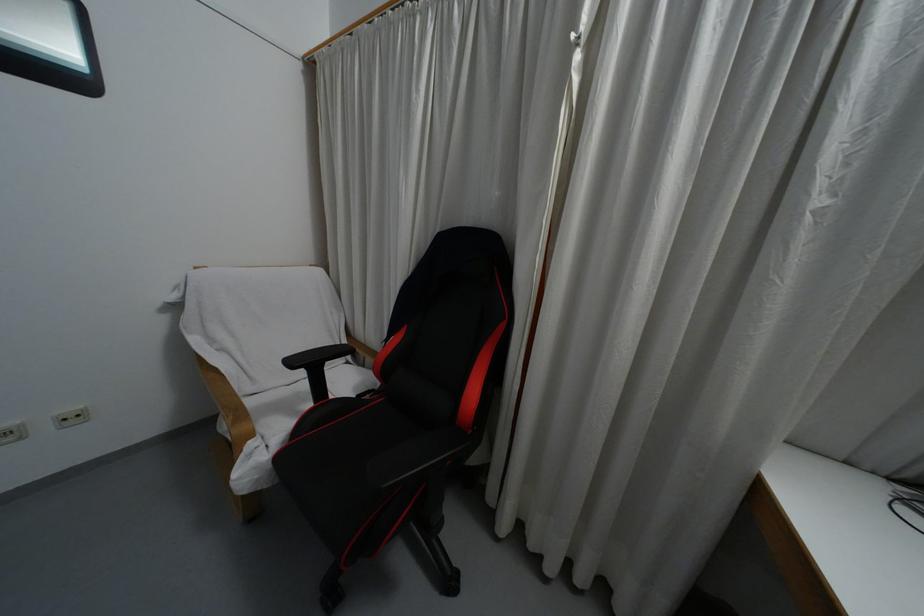
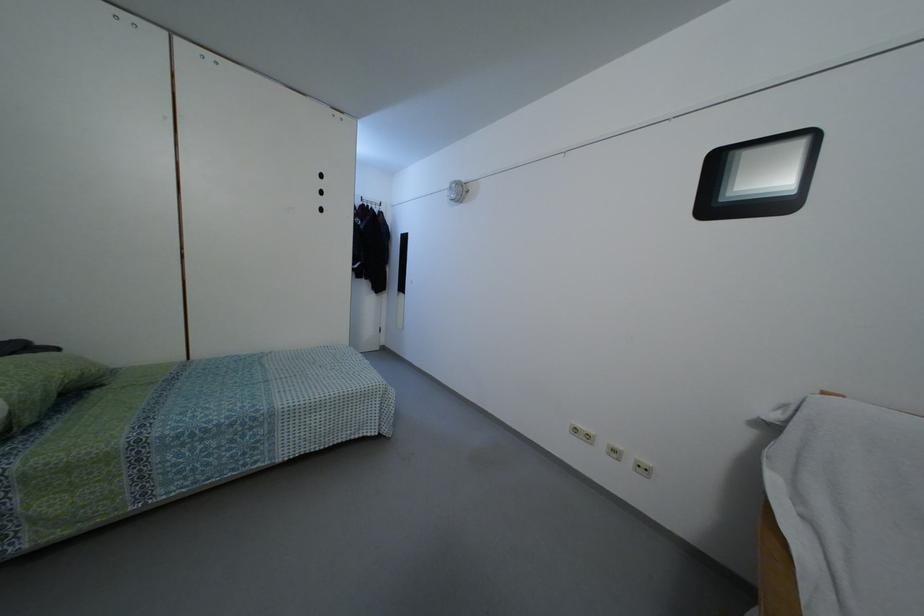
Question: The camera is either moving clockwise (left) or counter-clockwise (right) around the object. The first image is from the beginning of the video and the second image is from the end. Is the camera moving left or right when shooting the video?

Choices:
 (A) Left
 (B) Right

Answer: (B)